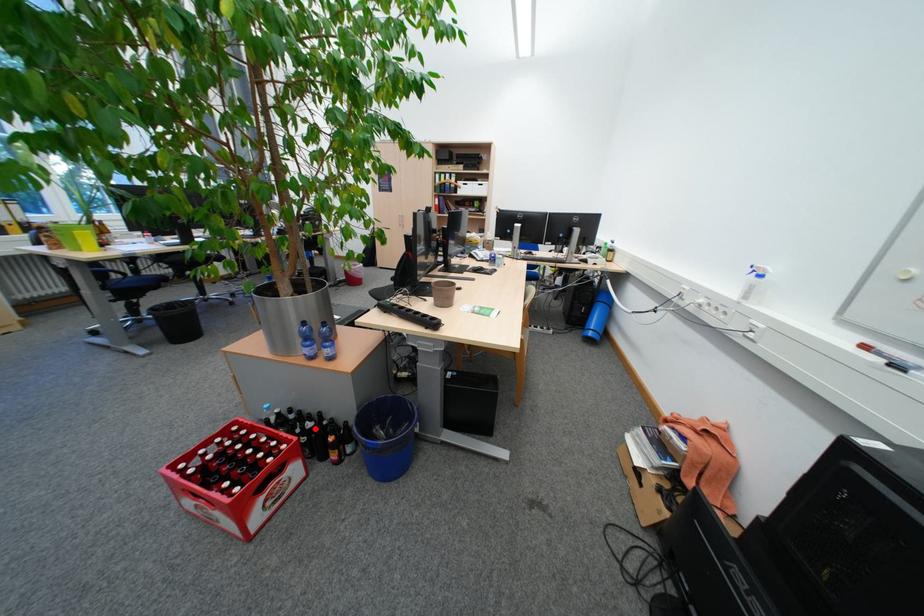
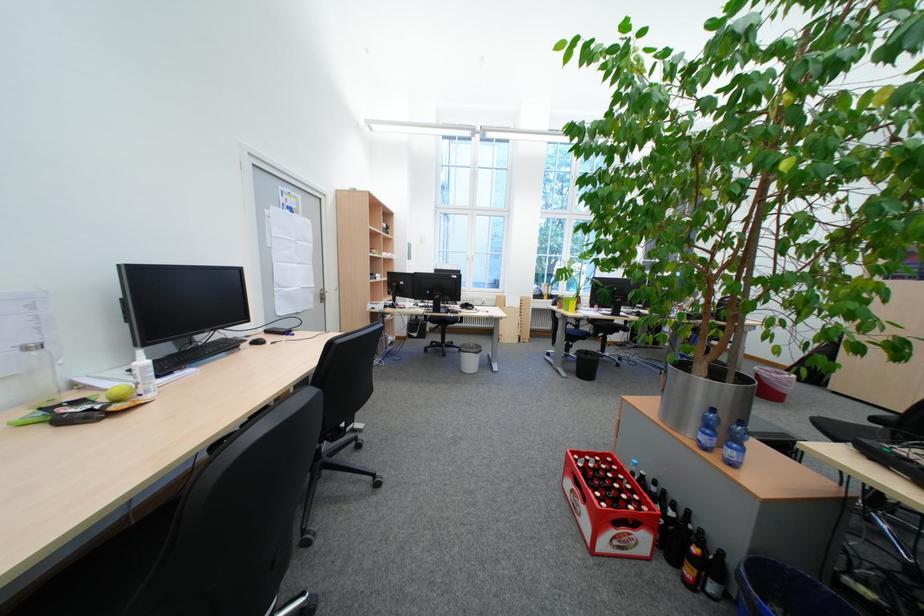
The point at the highlighted location is marked in the first image. Where is the corresponding point in the second image?

(676, 511)